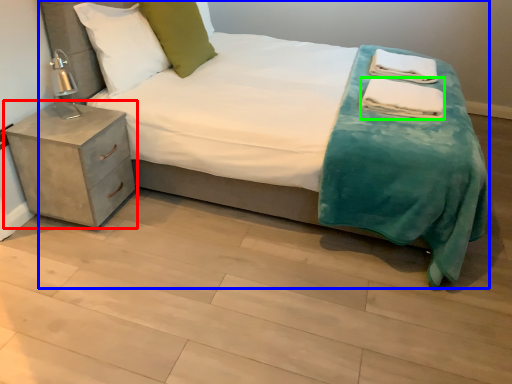
Question: Based on their relative distances, which object is nearer to nightstand (highlighted by a red box)? Choose from bed (highlighted by a blue box) and material (highlighted by a green box).

Choices:
 (A) bed
 (B) material

Answer: (A)